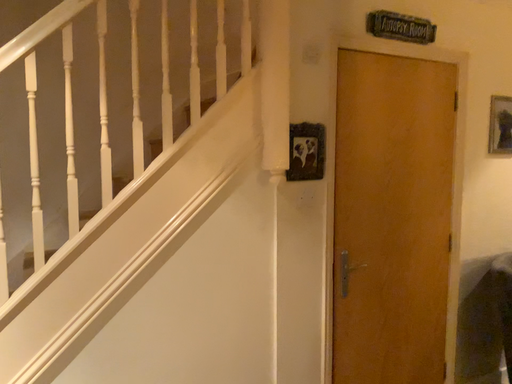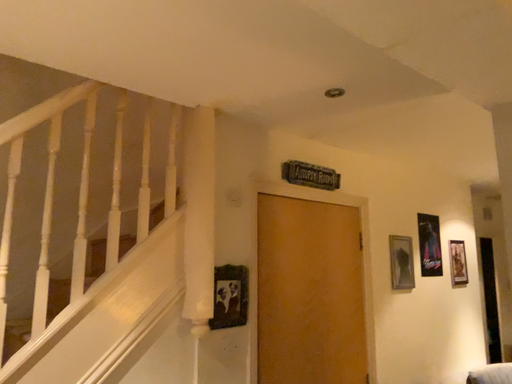
Question: How did the camera likely rotate when shooting the video?

Choices:
 (A) rotated downward
 (B) rotated upward

Answer: (B)